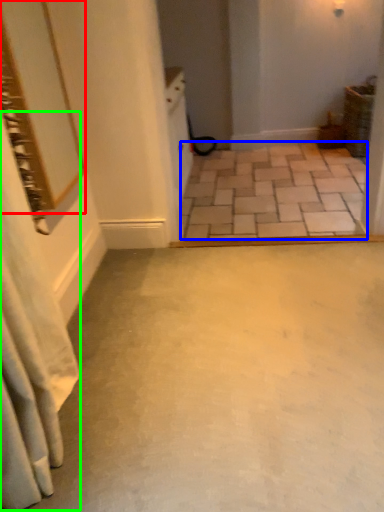
Question: Which object is positioned closest to mirror (highlighted by a red box)? Select from concrete (highlighted by a blue box) and shower curtain (highlighted by a green box).

Choices:
 (A) concrete
 (B) shower curtain

Answer: (B)